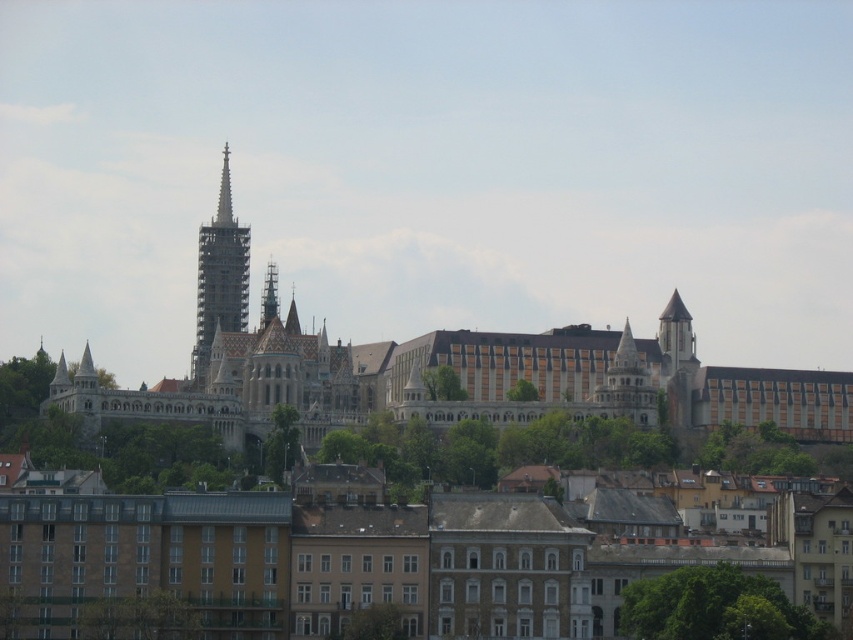
Consider the image. Does white stone castle at center have a larger size compared to smooth stone spire at center?

Correct, white stone castle at center is larger in size than smooth stone spire at center.

Can you confirm if white stone castle at center is wider than smooth stone spire at center?

Yes, white stone castle at center is wider than smooth stone spire at center.

You are a GUI agent. You are given a task and a screenshot of the screen. Output one action in this format:
    pyautogui.click(x=<x>, y=<y>)
    Task: Click on the white stone castle at center
    
    Given the screenshot: What is the action you would take?
    pyautogui.click(x=444, y=369)

Identify the location of white stone castle at center. (444, 369).

What do you see at coordinates (444, 369) in the screenshot? I see `white stone castle at center` at bounding box center [444, 369].

This screenshot has width=853, height=640. I want to click on white stone castle at center, so click(444, 369).

Which is behind, point (57, 392) or point (201, 344)?

Positioned behind is point (201, 344).

I want to click on white stone castle at center, so click(444, 369).

Does white stone spire at center appear on the left side of smooth stone spire at center?

Yes, white stone spire at center is to the left of smooth stone spire at center.

This screenshot has height=640, width=853. Describe the element at coordinates (219, 278) in the screenshot. I see `white stone spire at center` at that location.

Identify the location of white stone spire at center. tap(219, 278).